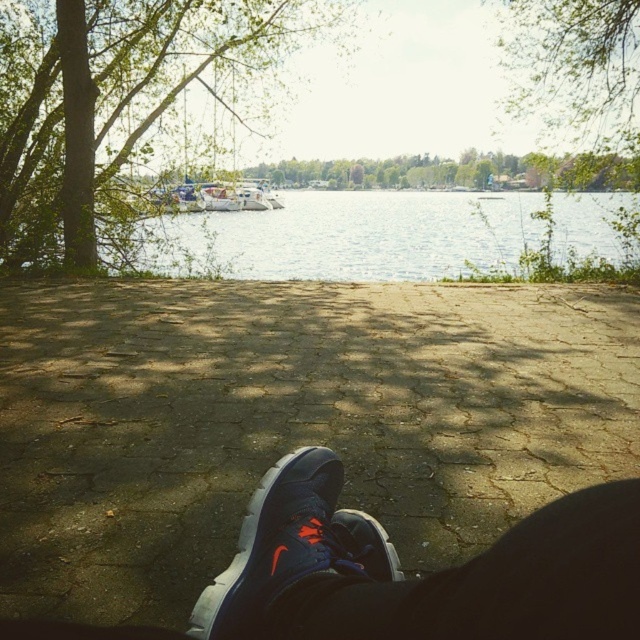
You are standing at the point marked by point (426,577) and want to walk towards the lake. Which direction should you go?

The point (426,577) represents the matte blue shoe at lower center. Since the lake is in the center of the image, you should walk forward to reach the lake.

You are standing at the point labeled point (576,61) in the image. What can you see directly in front of you?

The point (576,61) indicates a green leafy tree at upper center, so you would see the green leafy tree at upper center directly in front of you.